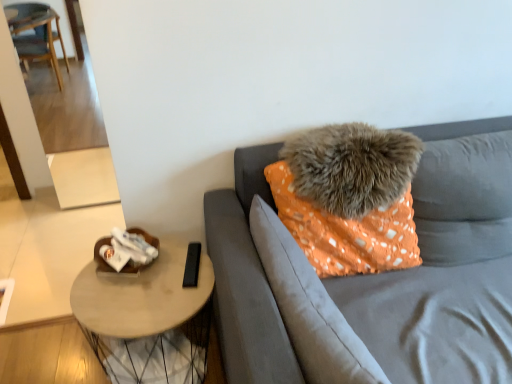
Locate an element on the screen. The image size is (512, 384). free space above light brown wooden table at lower left (from a real-world perspective) is located at coordinates (142, 286).